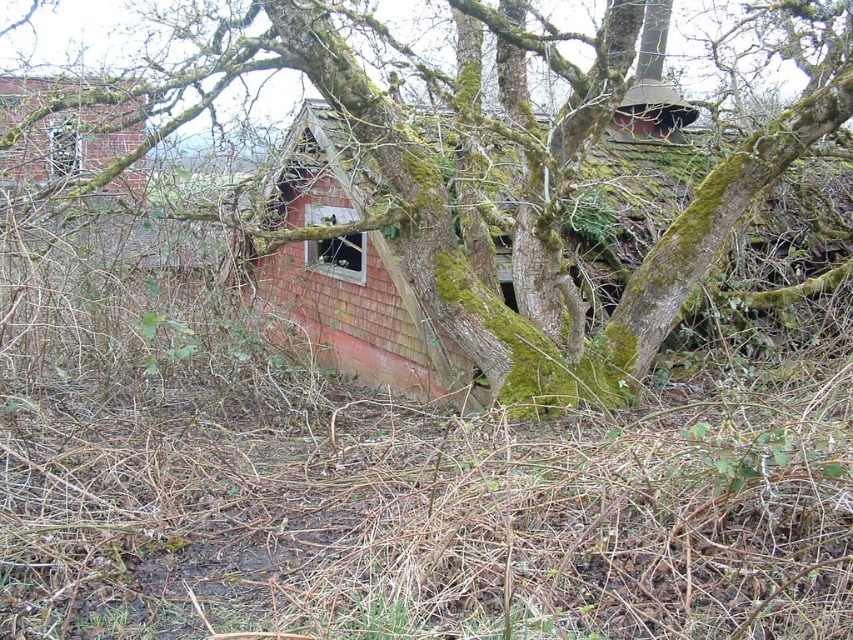
Question: Does green mossy tree at center appear on the right side of red shingled hut at center?

Choices:
 (A) yes
 (B) no

Answer: (A)

Question: Is green mossy tree at center closer to camera compared to red shingled hut at center?

Choices:
 (A) yes
 (B) no

Answer: (A)

Question: Can you confirm if green mossy tree at center is bigger than red shingled hut at center?

Choices:
 (A) yes
 (B) no

Answer: (A)